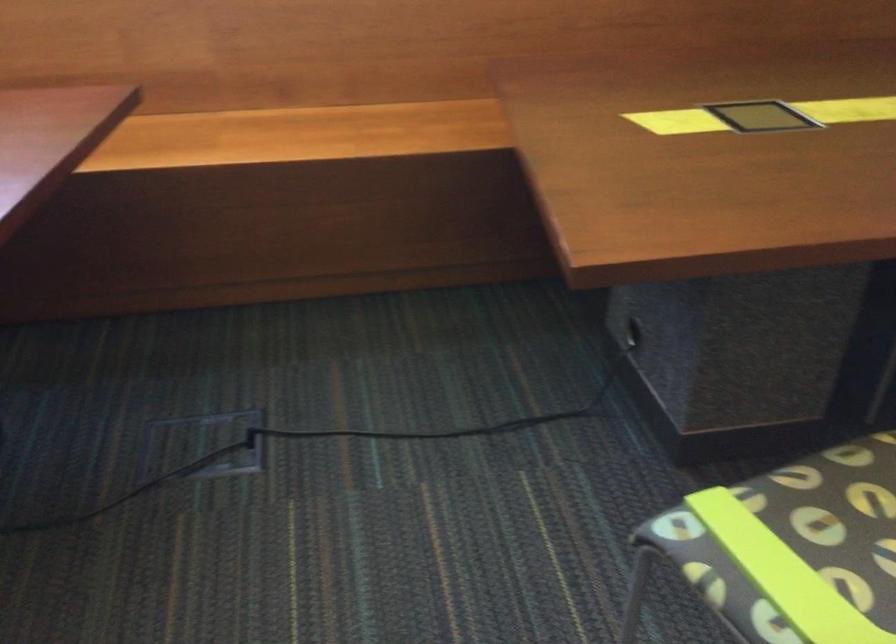
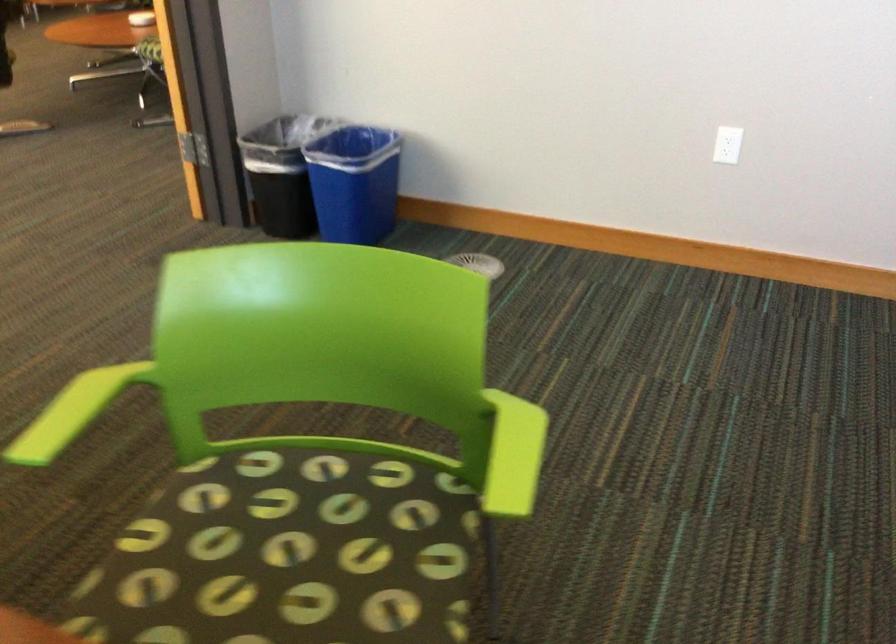
Find the pixel in the second image that matches pixel 748 567 in the first image.

(513, 455)